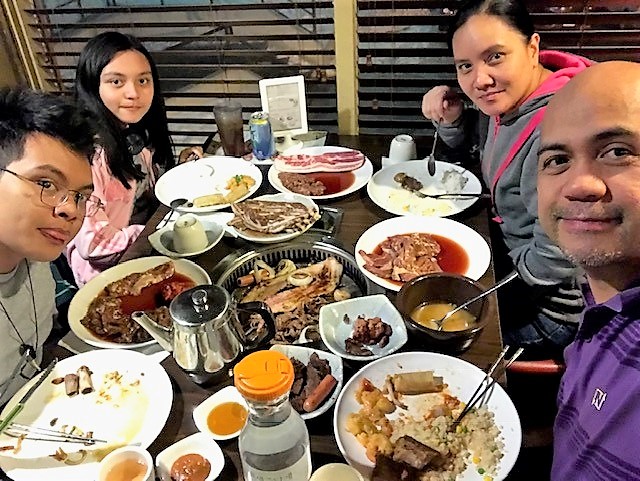
At what (x,y) coordinates should I click in order to perform the action: click on bowls. Please return your answer as a coordinate pair (x, y). Image resolution: width=640 pixels, height=481 pixels. Looking at the image, I should click on (198, 445), (198, 416), (333, 366), (328, 328), (413, 293), (212, 236), (259, 233).